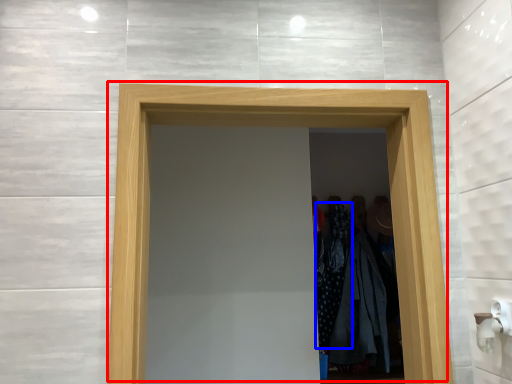
Question: Which object is closer to the camera taking this photo, door (highlighted by a red box) or clothing (highlighted by a blue box)?

Choices:
 (A) door
 (B) clothing

Answer: (A)